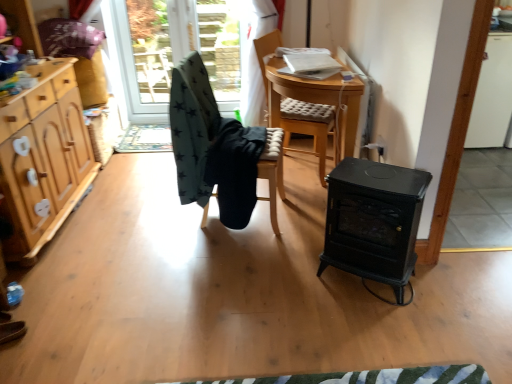
The image size is (512, 384). I want to click on free space in front of dark green fabric chair at center, positioned as the third chair in right-to-left order, so click(x=237, y=263).